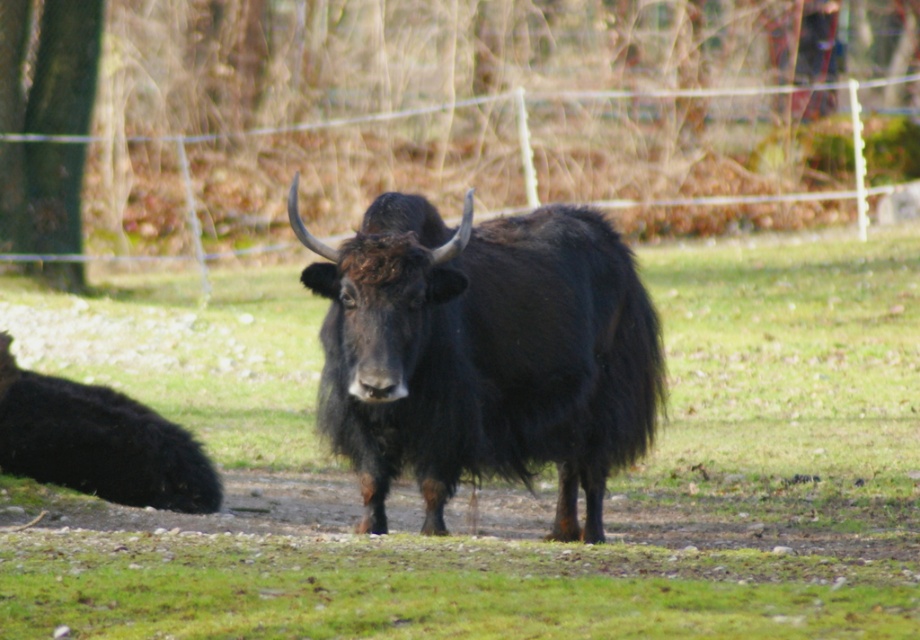
Question: Observing the image, what is the correct spatial positioning of black fuzzy yak at center in reference to black fuzzy yak at lower left?

Choices:
 (A) left
 (B) right

Answer: (B)

Question: Which of the following is the closest to the observer?

Choices:
 (A) (398, 236)
 (B) (19, 476)
 (C) (58, 576)

Answer: (C)

Question: Does black fuzzy yak at center have a larger size compared to black fuzzy bull at center?

Choices:
 (A) no
 (B) yes

Answer: (B)

Question: Does black fuzzy yak at center have a smaller size compared to black fuzzy bull at center?

Choices:
 (A) no
 (B) yes

Answer: (A)

Question: Considering the real-world distances, which object is closest to the black fuzzy yak at center?

Choices:
 (A) black fuzzy yak at lower left
 (B) black fuzzy bull at center

Answer: (A)

Question: Estimate the real-world distances between objects in this image. Which object is closer to the black fuzzy yak at center?

Choices:
 (A) black fuzzy bull at center
 (B) black fuzzy yak at lower left

Answer: (B)